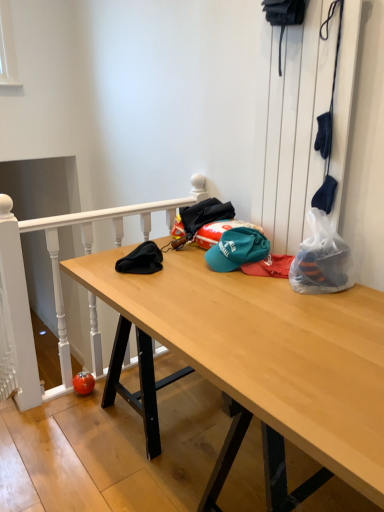
You are a GUI agent. You are given a task and a screenshot of the screen. Output one action in this format:
    pyautogui.click(x=<x>, y=<y>)
    Task: Click on the blank area beneath teal fabric cap at center (from a real-world perspective)
    
    Given the screenshot: What is the action you would take?
    pyautogui.click(x=223, y=410)